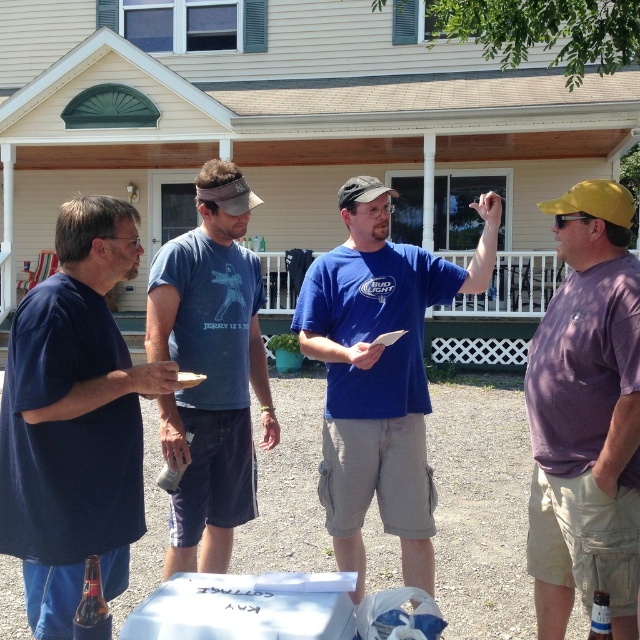
Question: Does purple cotton shirt at right come in front of matte plastic cup at center?

Choices:
 (A) yes
 (B) no

Answer: (B)

Question: Can you confirm if dark blue t-shirt at left is smaller than blue cotton shirt at center?

Choices:
 (A) no
 (B) yes

Answer: (B)

Question: Is purple cotton shirt at right to the left of matte plastic cup at center from the viewer's perspective?

Choices:
 (A) no
 (B) yes

Answer: (A)

Question: Which of the following is the closest to the observer?

Choices:
 (A) matte plastic cup at center
 (B) dark blue t-shirt at left
 (C) blue cotton shirt at center

Answer: (B)

Question: Which of the following is the farthest from the observer?

Choices:
 (A) blue cotton t-shirt at center
 (B) matte plastic cup at center
 (C) blue cotton shirt at center

Answer: (C)

Question: Among these points, which one is nearest to the camera?

Choices:
 (A) (624, 336)
 (B) (355, 324)

Answer: (A)